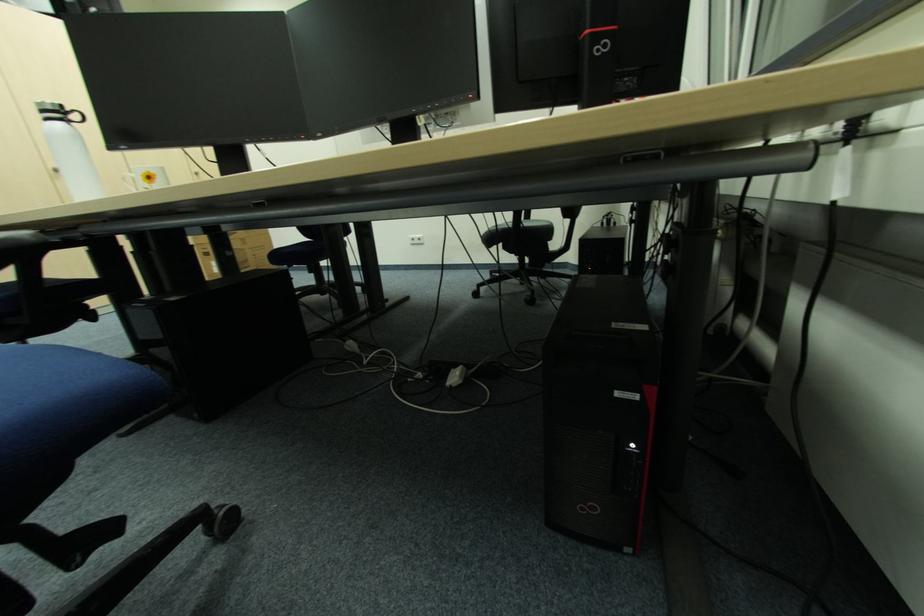
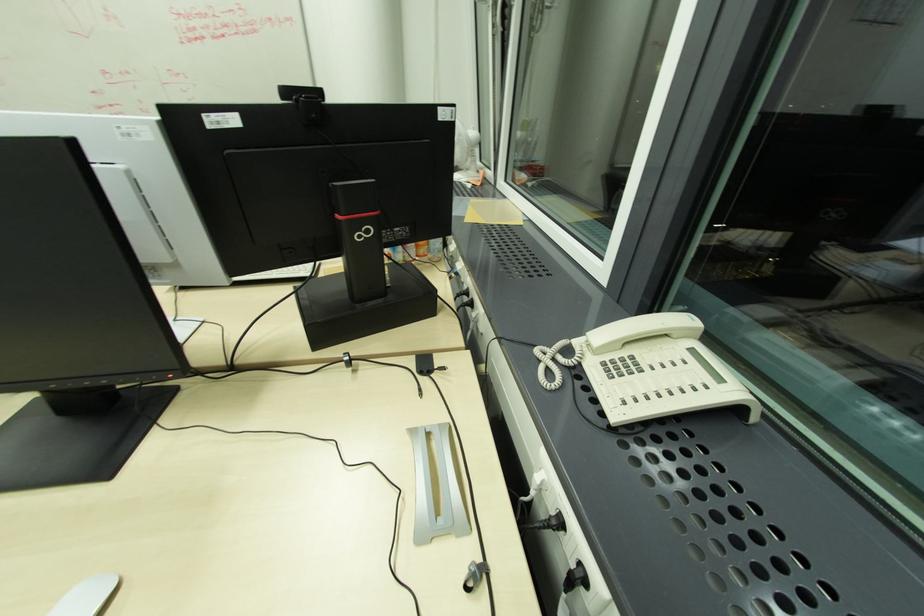
Question: The camera is either moving clockwise (left) or counter-clockwise (right) around the object. The first image is from the beginning of the video and the second image is from the end. Is the camera moving left or right when shooting the video?

Choices:
 (A) Left
 (B) Right

Answer: (A)